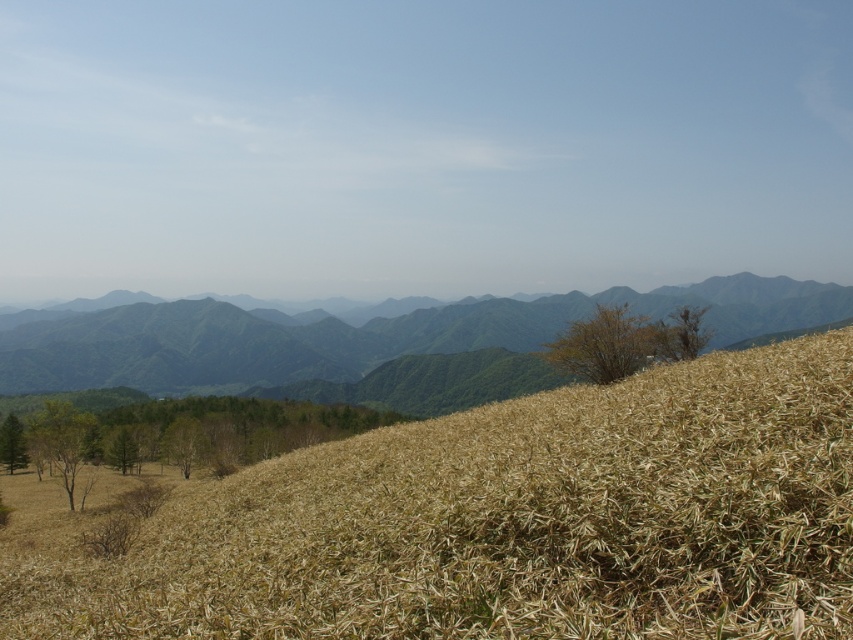
Question: Which is nearer to the brown textured tree at upper right?

Choices:
 (A) green leafy tree at lower left
 (B) green matte tree at lower left
 (C) brown dry grass at center
 (D) green matte tree at center

Answer: (C)

Question: Can you confirm if green textured mountains at center is wider than brown textured bush at center-right?

Choices:
 (A) no
 (B) yes

Answer: (B)

Question: Is green textured mountains at center wider than brown textured bush at center-right?

Choices:
 (A) no
 (B) yes

Answer: (B)

Question: Can you confirm if green textured mountains at center is positioned above green matte tree at lower left?

Choices:
 (A) no
 (B) yes

Answer: (B)

Question: Which point is closer to the camera taking this photo?

Choices:
 (A) (706, 336)
 (B) (18, 435)
 (C) (183, 444)

Answer: (A)

Question: Which point is farther to the camera?

Choices:
 (A) brown dry grass at center
 (B) green matte tree at lower left
 (C) green textured mountains at center

Answer: (B)